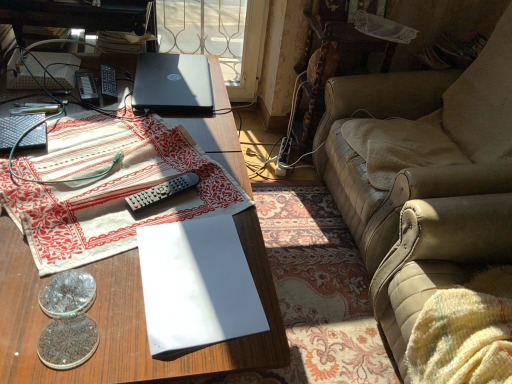
Identify the location of free space between black plastic remote control at upper left, the 3th remote control from the right, and white cotton tablecloth at left. (60, 97).